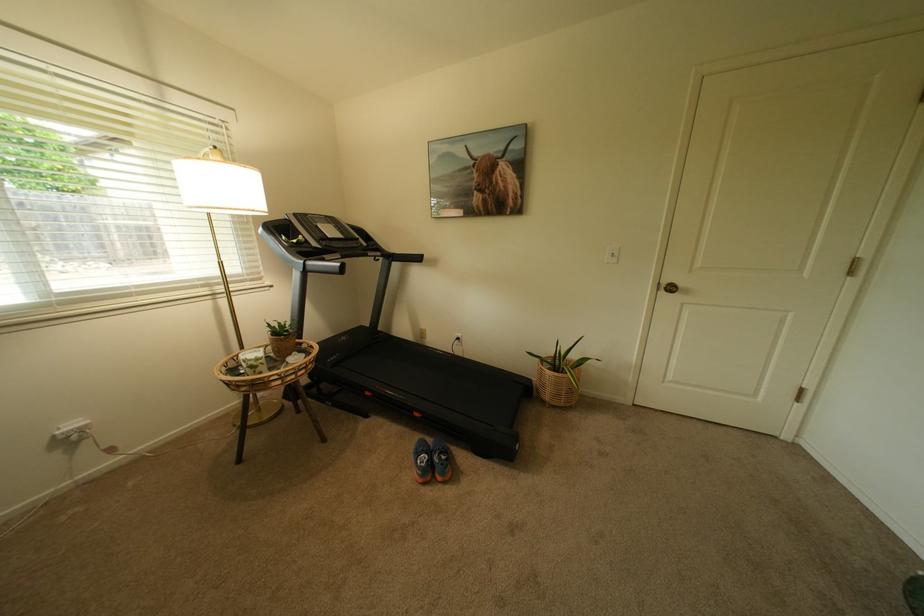
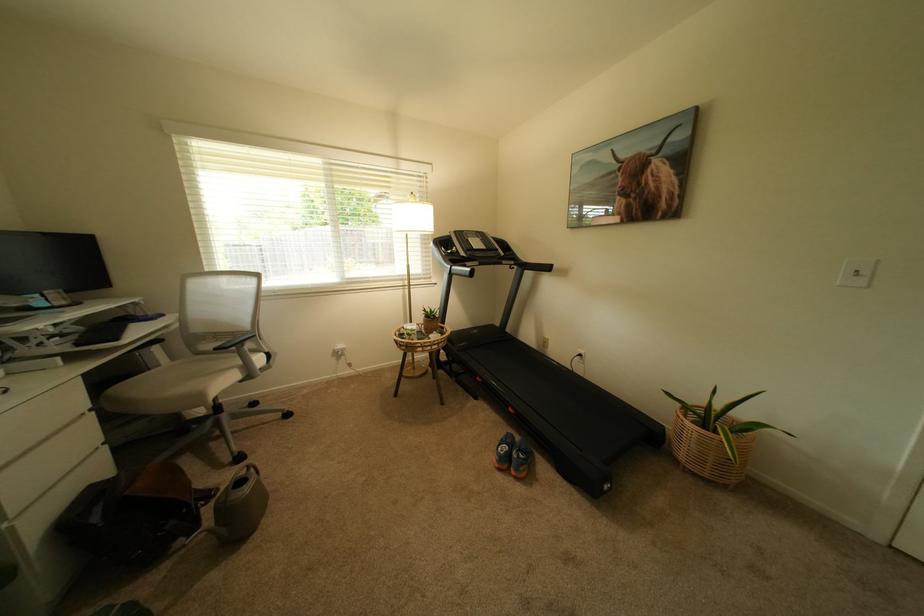
Where in the second image is the point corresponding to the point at 396,262 from the first image?

(529, 270)